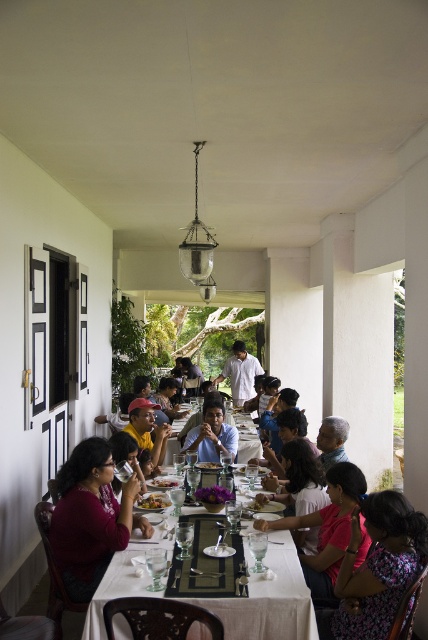
You are a photographer standing behind the table at the dining scene. You want to take a photo that includes both the white cotton shirt at center and the smooth white plate at center. Which object should you focus on first if you want to ensure both are in the frame without moving the camera?

You should focus on the white cotton shirt at center first because it is taller than the smooth white plate at center, so it will occupy more vertical space in the frame, ensuring both are captured without needing to adjust the camera position.

You are a photographer at the event and want to capture a photo of the blue shirt at center without the floral fabric dress at lower right blocking it. How should you adjust your position?

Move behind the floral fabric dress at lower right so that the blue shirt at center is visible beyond it, since the floral fabric dress at lower right is in front of the blue shirt at center.